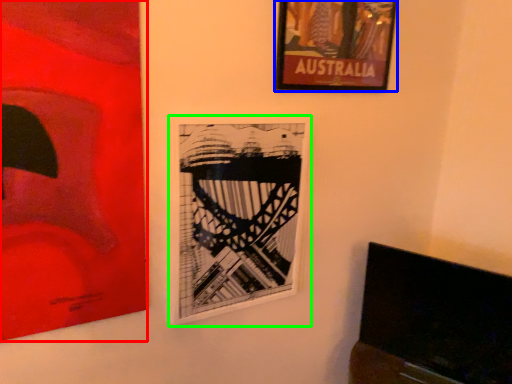
Question: Considering the real-world distances, which object is farthest from picture frame (highlighted by a red box)? picture frame (highlighted by a blue box) or picture frame (highlighted by a green box)?

Choices:
 (A) picture frame
 (B) picture frame

Answer: (A)